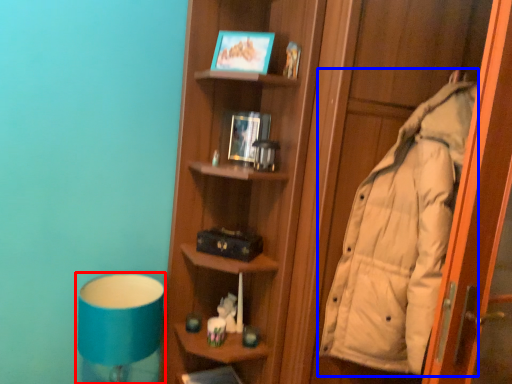
Question: Which point is closer to the camera, bedside lamp (highlighted by a red box) or coat (highlighted by a blue box)?

Choices:
 (A) bedside lamp
 (B) coat

Answer: (B)